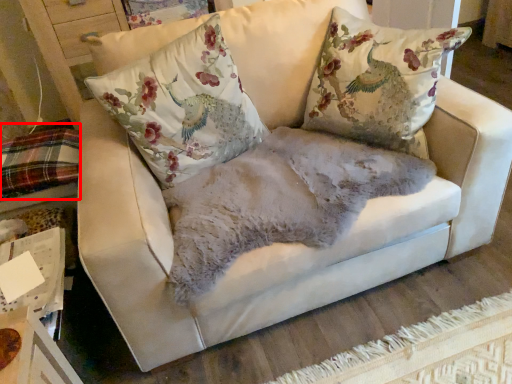
Question: In this image, where is bedding (annotated by the red box) located relative to pillow?

Choices:
 (A) left
 (B) right

Answer: (A)